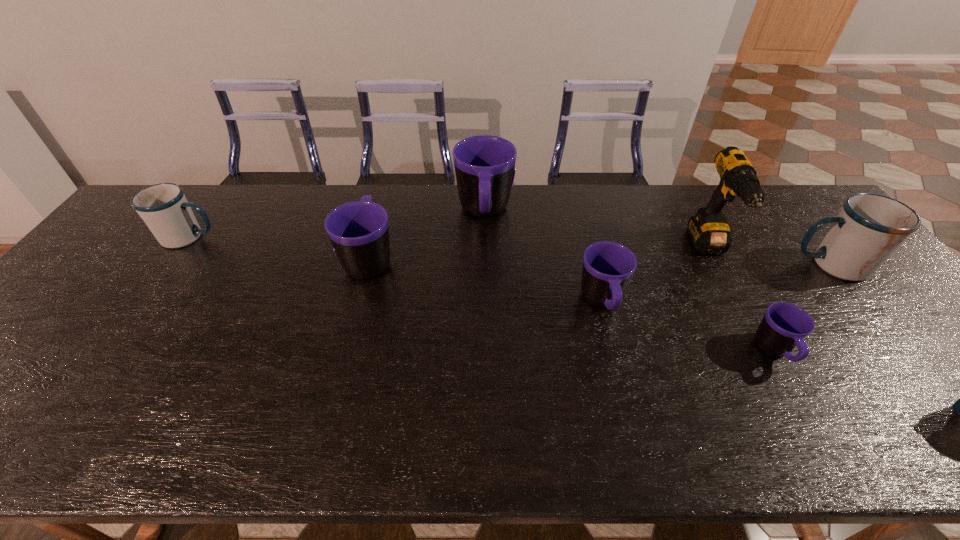
Locate an element on the screen. Image resolution: width=960 pixels, height=540 pixels. black drill is located at coordinates click(709, 231).

Locate an element on the screen. The height and width of the screenshot is (540, 960). the tallest object is located at coordinates (709, 231).

Image resolution: width=960 pixels, height=540 pixels. In order to click on the third black mug from right to left in this screenshot , I will do `click(484, 165)`.

Identify the location of the fifth object from right to left. (484, 165).

Find the location of a particular element. the bigger white mug is located at coordinates (869, 228).

Where is `the right white mug`? the right white mug is located at coordinates (869, 228).

At what (x,y) coordinates should I click in order to perform the action: click on the fifth mug from right to left. Please return your answer as a coordinate pair (x, y). Looking at the image, I should click on (359, 232).

In order to click on the second object from left to right in this screenshot , I will do `click(359, 232)`.

Locate an element on the screen. the leftmost mug is located at coordinates coord(164,208).

Identify the location of the smaller white mug. (164, 208).